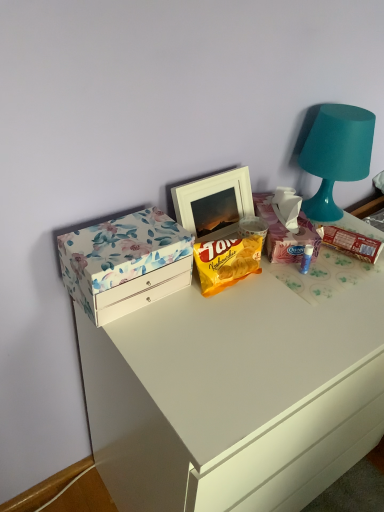
Locate an element on the screen. free spot to the right of yellow matte snack packet at center, the first snack when ordered from left to right is located at coordinates (309, 291).